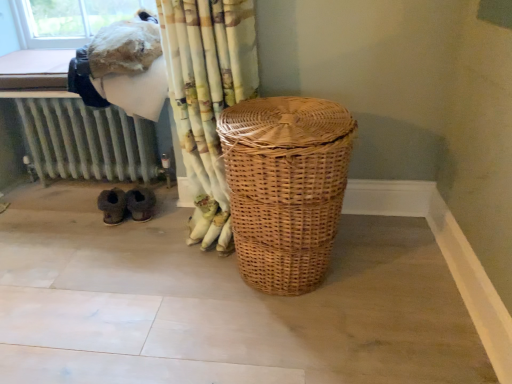
I want to click on free point in front of brown suede slippers at lower left, so click(x=123, y=251).